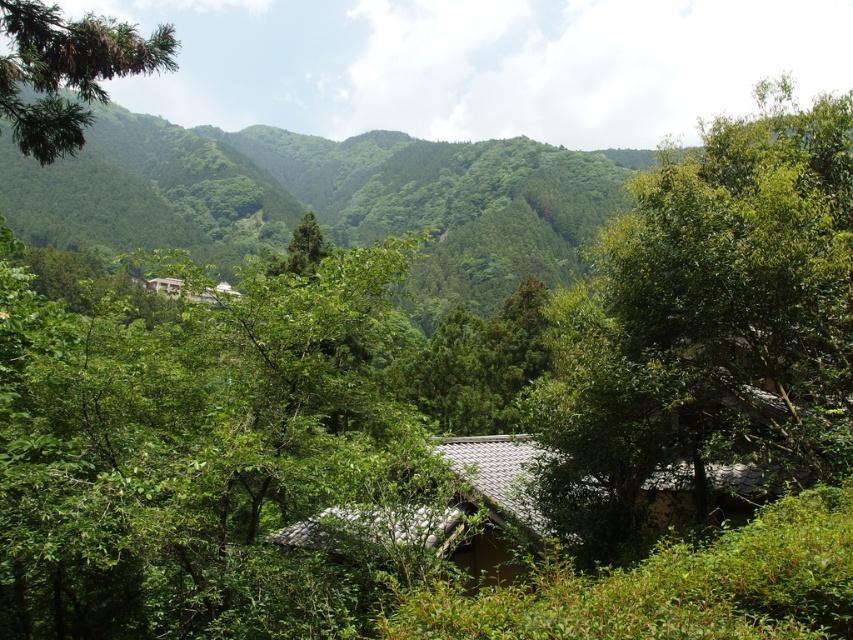
Question: Which object is farther from the camera taking this photo?

Choices:
 (A) green leafy branch at upper left
 (B) green leafy tree at center
 (C) light brown wooden hut at center

Answer: (B)

Question: Is green leafy branch at upper left above light brown wooden hut at center?

Choices:
 (A) yes
 (B) no

Answer: (A)

Question: Among these objects, which one is nearest to the camera?

Choices:
 (A) light brown wooden hut at center
 (B) brown tile roof hut at center
 (C) green leafy branch at upper left
 (D) green leafy tree at center

Answer: (B)

Question: Can you confirm if green leafy tree at center is wider than brown tile roof hut at center?

Choices:
 (A) yes
 (B) no

Answer: (A)

Question: Does green leafy tree at center appear under green leafy branch at upper left?

Choices:
 (A) yes
 (B) no

Answer: (A)

Question: Among these points, which one is farthest from the camera?

Choices:
 (A) (778, 250)
 (B) (160, 278)
 (C) (68, 113)

Answer: (B)